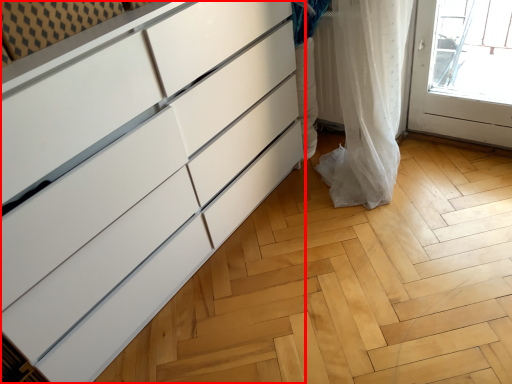
Question: Observing the image, what is the correct spatial positioning of chest of drawers (annotated by the red box) in reference to curtain?

Choices:
 (A) right
 (B) left

Answer: (B)